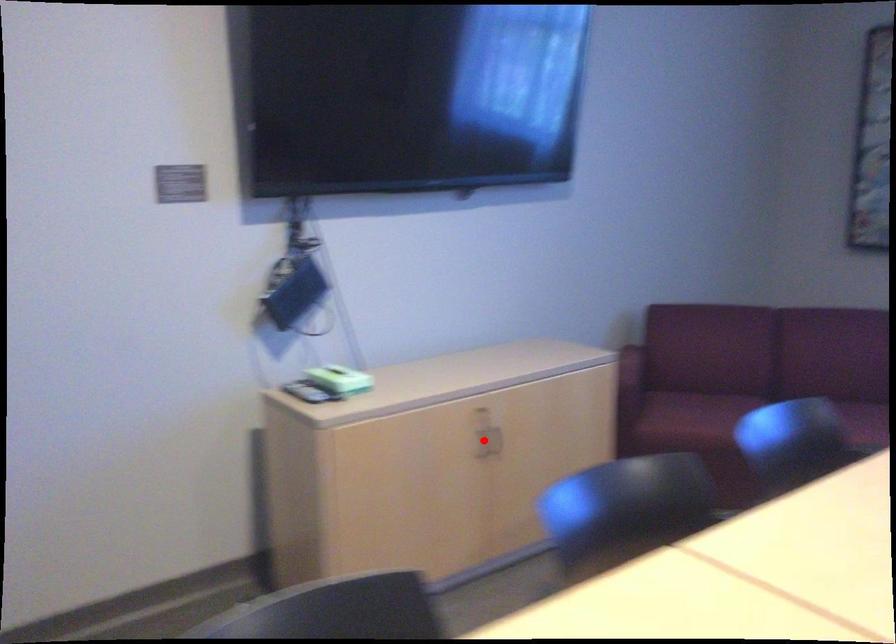
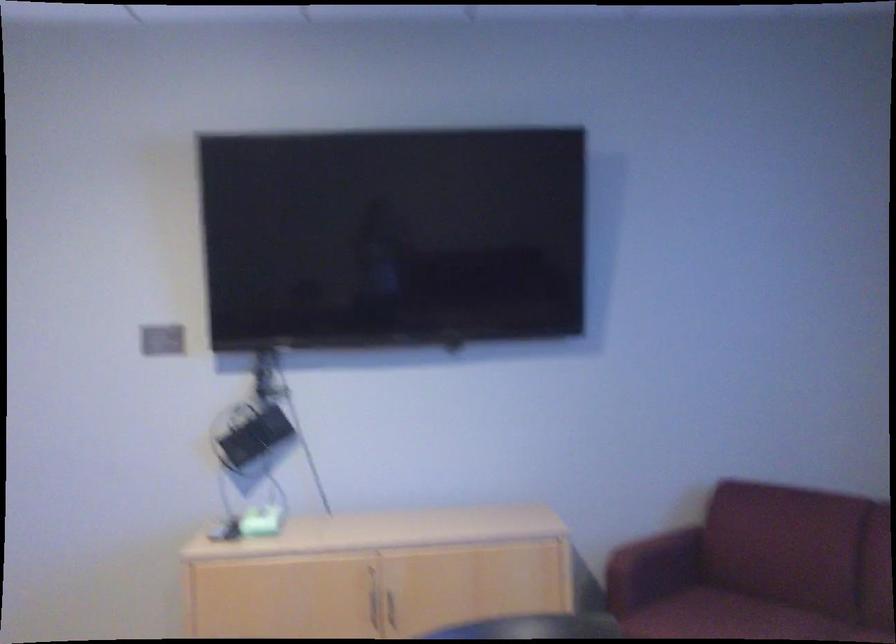
Where in the second image is the point corresponding to the highlighted location from the first image?

(374, 607)